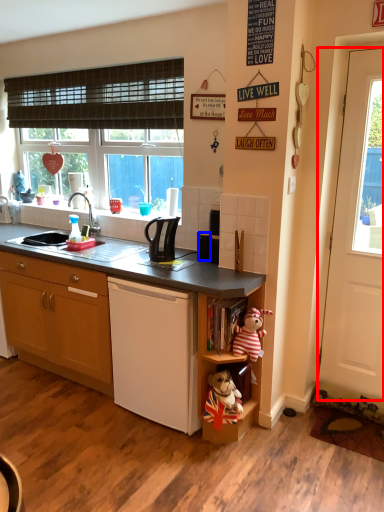
Question: Among these objects, which one is farthest to the camera, door (highlighted by a red box) or appliance (highlighted by a blue box)?

Choices:
 (A) door
 (B) appliance

Answer: (B)